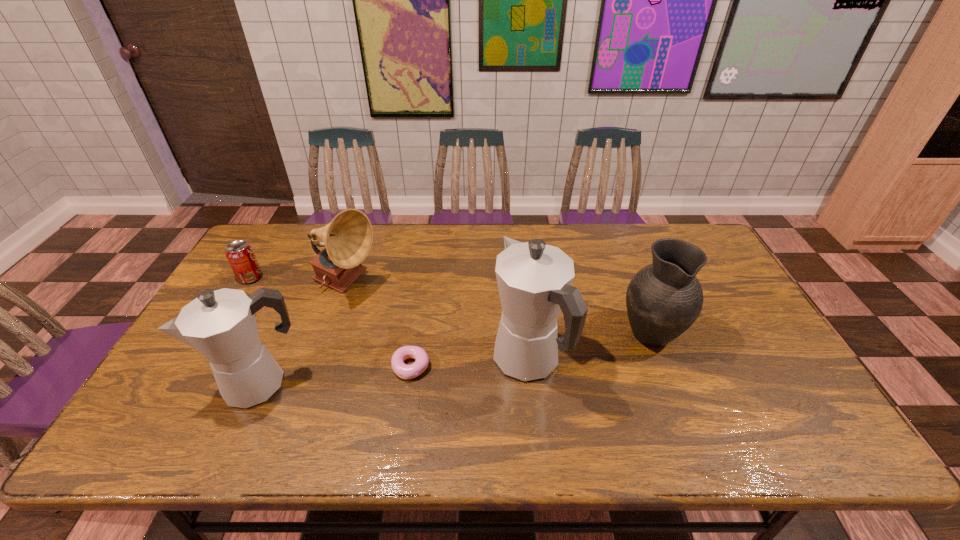
Where is `vacant space that's between the left coffeepot and the rightmost object`? This screenshot has width=960, height=540. vacant space that's between the left coffeepot and the rightmost object is located at coordinates (455, 358).

Image resolution: width=960 pixels, height=540 pixels. I want to click on empty space that is in between the phonograph record and the fifth tallest object, so click(299, 281).

Where is `free space between the second shortest object and the rightmost object`? free space between the second shortest object and the rightmost object is located at coordinates (450, 304).

This screenshot has width=960, height=540. Identify the location of vacant region between the taller coffeepot and the leftmost object. (389, 319).

Identify which object is the nearest to the pitcher. Please provide its 2D coordinates. Your answer should be formatted as a tuple, i.e. [(x, y)], where the tuple contains the x and y coordinates of a point satisfying the conditions above.

[(534, 279)]

You are a GUI agent. You are given a task and a screenshot of the screen. Output one action in this format:
    pyautogui.click(x=<x>, y=<y>)
    Task: Click on the second closest object relative to the pitcher
    This screenshot has height=540, width=960.
    Given the screenshot: What is the action you would take?
    pyautogui.click(x=402, y=370)

At what (x,y) coordinates should I click in order to perform the action: click on blank area in the image that satisfies the following two spatial constraints: 1. on the horn of the phonograph record; 2. on the left side of the shortest object. Please return your answer as a coordinate pair (x, y). Image resolution: width=960 pixels, height=540 pixels. Looking at the image, I should click on (319, 367).

The image size is (960, 540). I want to click on vacant position in the image that satisfies the following two spatial constraints: 1. on the horn of the phonograph record; 2. on the side of the rightmost object with the handle, so click(330, 331).